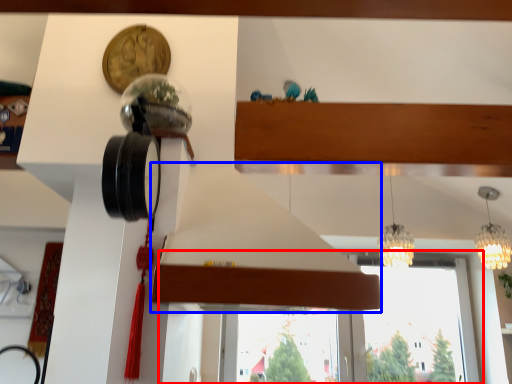
Question: Which object appears farthest to the camera in this image, window (highlighted by a red box) or exhaust hood (highlighted by a blue box)?

Choices:
 (A) window
 (B) exhaust hood

Answer: (A)